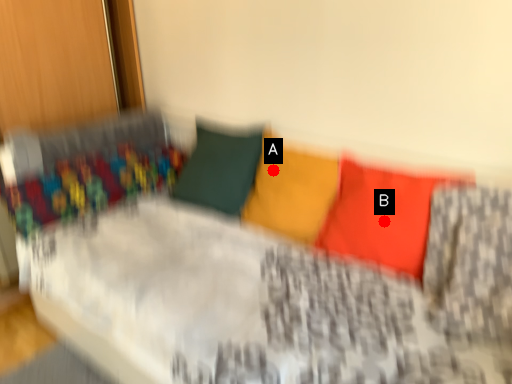
Question: Two points are circled on the image, labeled by A and B beside each circle. Which point is closer to the camera?

Choices:
 (A) A is closer
 (B) B is closer

Answer: (B)